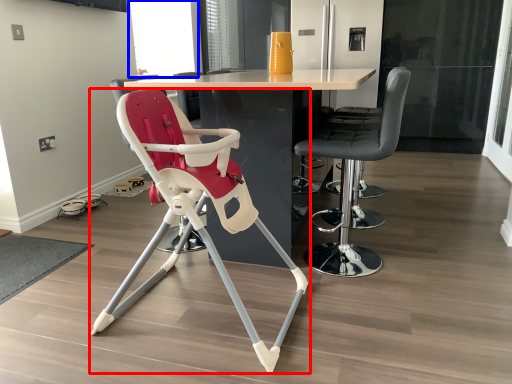
Question: Which of the following is the farthest to the observer, chair (highlighted by a red box) or window screen (highlighted by a blue box)?

Choices:
 (A) chair
 (B) window screen

Answer: (B)